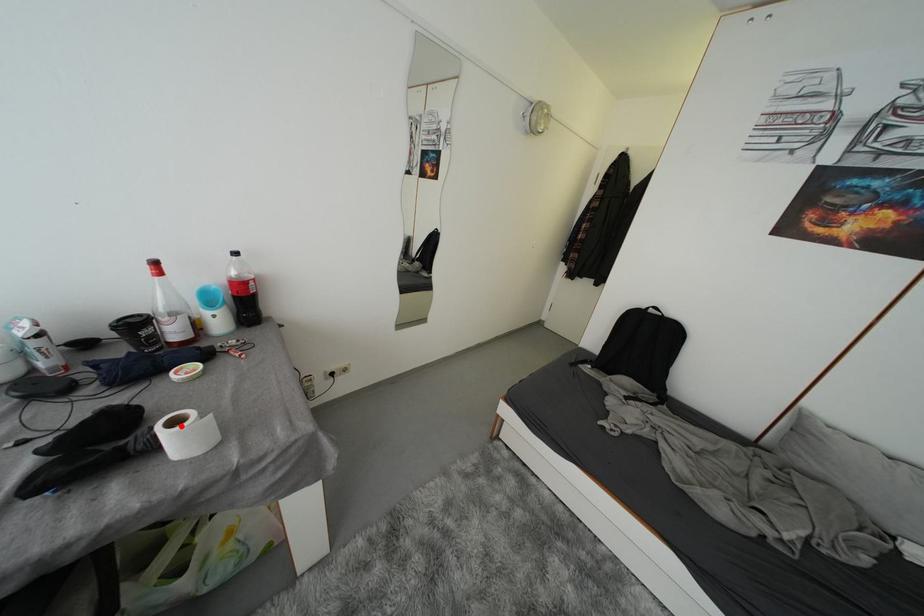
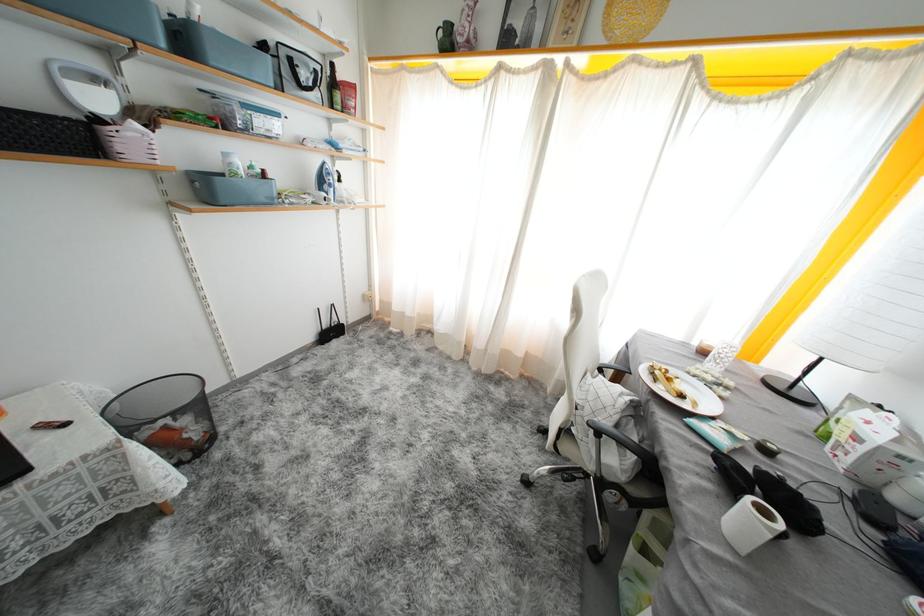
Question: A red point is marked in image1. In image2, is the corresponding 3D point closer to the camera or farther? Reply with the corresponding letter.

Choices:
 (A) The corresponding 3D point is closer.
 (B) The corresponding 3D point is farther.

Answer: (A)